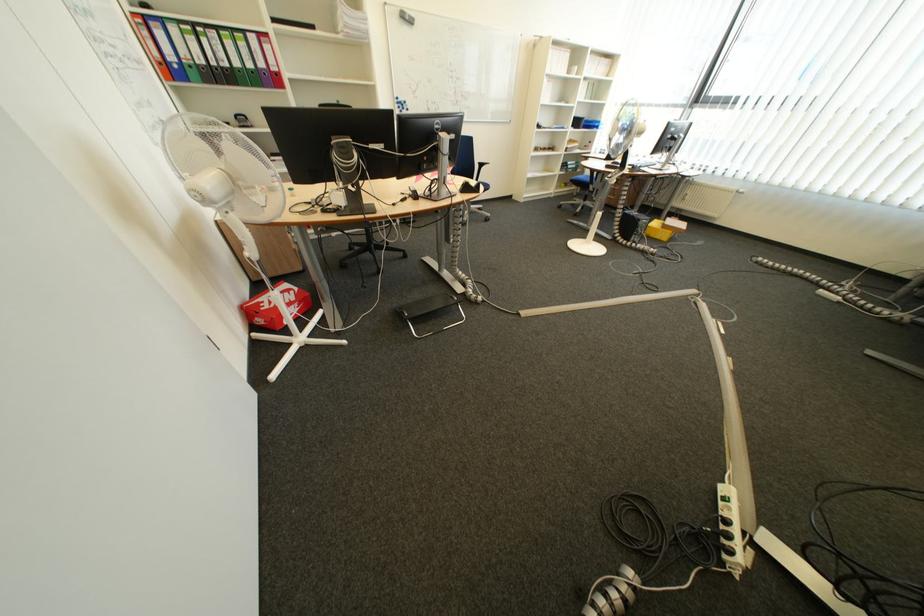
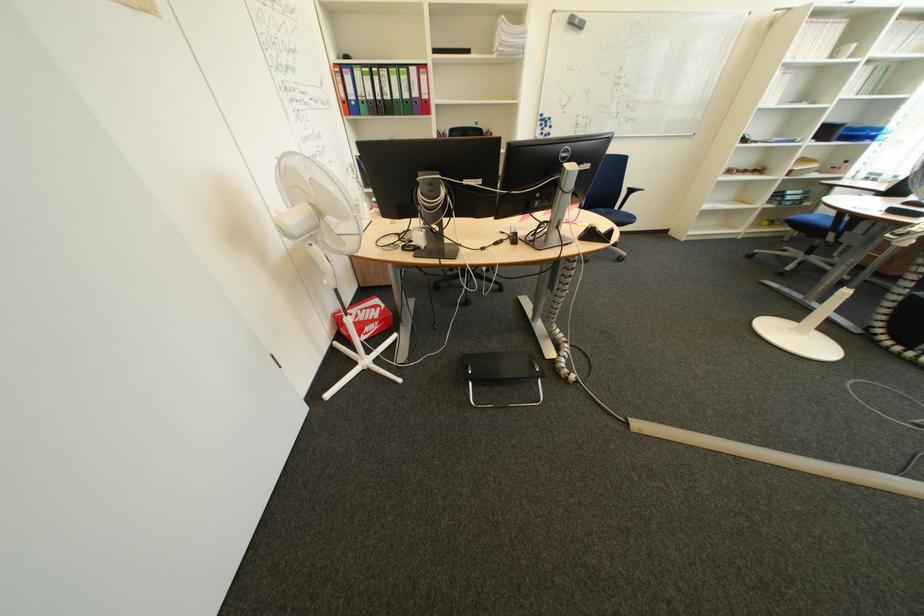
Locate, in the second image, the point that corresponds to (306,308) in the first image.

(385, 326)